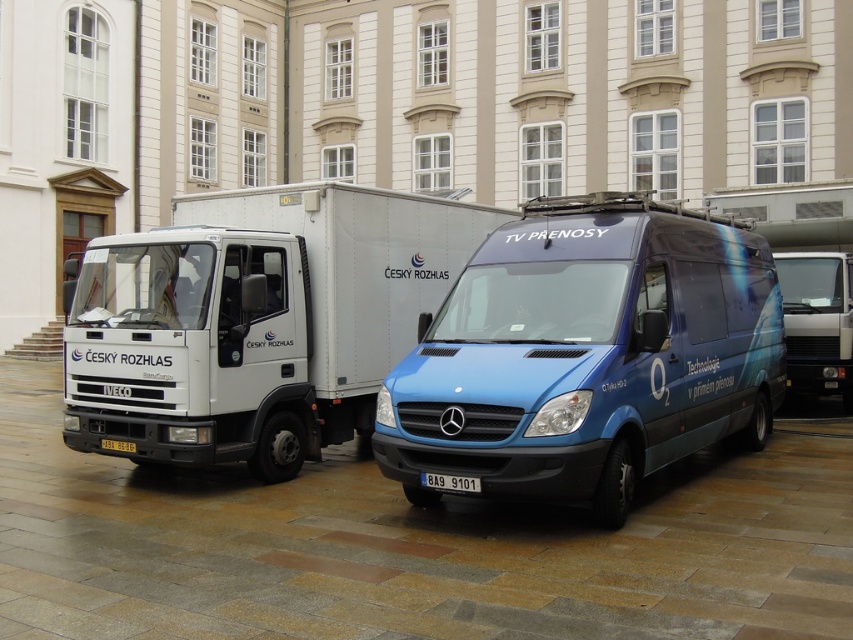
Can you confirm if white matte truck at center is thinner than white plastic license plate at center?

No, white matte truck at center is not thinner than white plastic license plate at center.

Can you confirm if white matte truck at center is positioned to the left of white plastic license plate at center?

Correct, you'll find white matte truck at center to the left of white plastic license plate at center.

Which is in front, point (254, 308) or point (438, 484)?

Point (438, 484) is in front.

Identify the location of white matte truck at center. pyautogui.click(x=256, y=321).

Can you confirm if blue metallic van at center is smaller than metallic silver van at center?

Yes, blue metallic van at center is smaller than metallic silver van at center.

Does blue metallic van at center lie behind metallic silver van at center?

That is False.

Find the location of a particular element. blue metallic van at center is located at coordinates (589, 353).

Does white matte truck at center have a lesser height compared to metallic silver van at center?

No.

Is white matte truck at center to the right of metallic silver van at center from the viewer's perspective?

No, white matte truck at center is not to the right of metallic silver van at center.

Does point (94, 314) come farther from viewer compared to point (845, 340)?

No, (94, 314) is in front of (845, 340).

You are a GUI agent. You are given a task and a screenshot of the screen. Output one action in this format:
    pyautogui.click(x=<x>, y=<y>)
    Task: Click on the white matte truck at center
    The width and height of the screenshot is (853, 640).
    Given the screenshot: What is the action you would take?
    pyautogui.click(x=256, y=321)